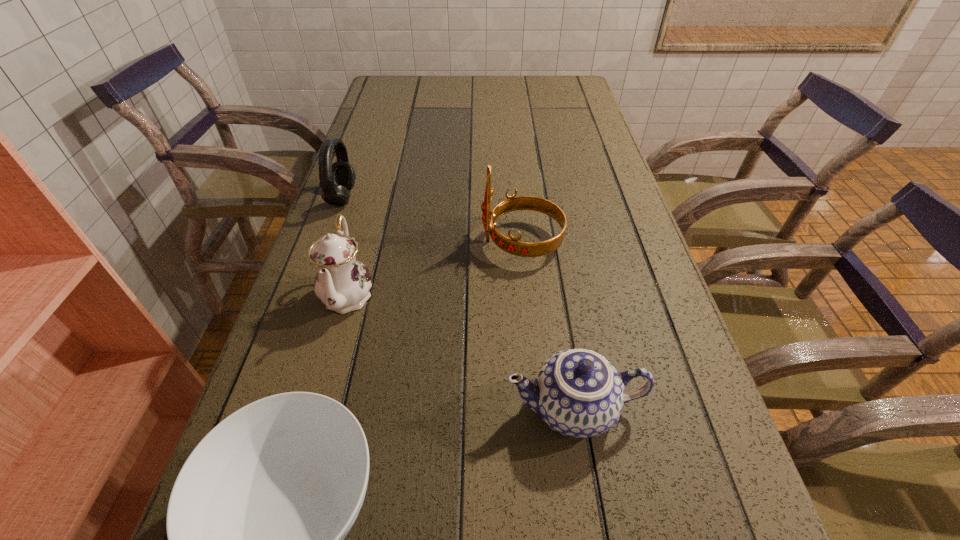
Find the location of a particular element. The width and height of the screenshot is (960, 540). blank area in the image that satisfies the following two spatial constraints: 1. on the back side of the farthest chinaware; 2. on the earcups of the farthest object is located at coordinates (375, 198).

Where is `free space in the image that satisfies the following two spatial constraints: 1. on the earcups of the farthest object; 2. on the back side of the farthest chinaware`? free space in the image that satisfies the following two spatial constraints: 1. on the earcups of the farthest object; 2. on the back side of the farthest chinaware is located at coordinates coord(307,294).

Locate an element on the screen. The height and width of the screenshot is (540, 960). free point that satisfies the following two spatial constraints: 1. on the earcups of the farthest object; 2. on the right side of the farthest chinaware is located at coordinates (307, 294).

Where is `blank space that satisfies the following two spatial constraints: 1. on the front-facing side of the tiara; 2. on the front side of the tallest chinaware`? blank space that satisfies the following two spatial constraints: 1. on the front-facing side of the tiara; 2. on the front side of the tallest chinaware is located at coordinates (526, 294).